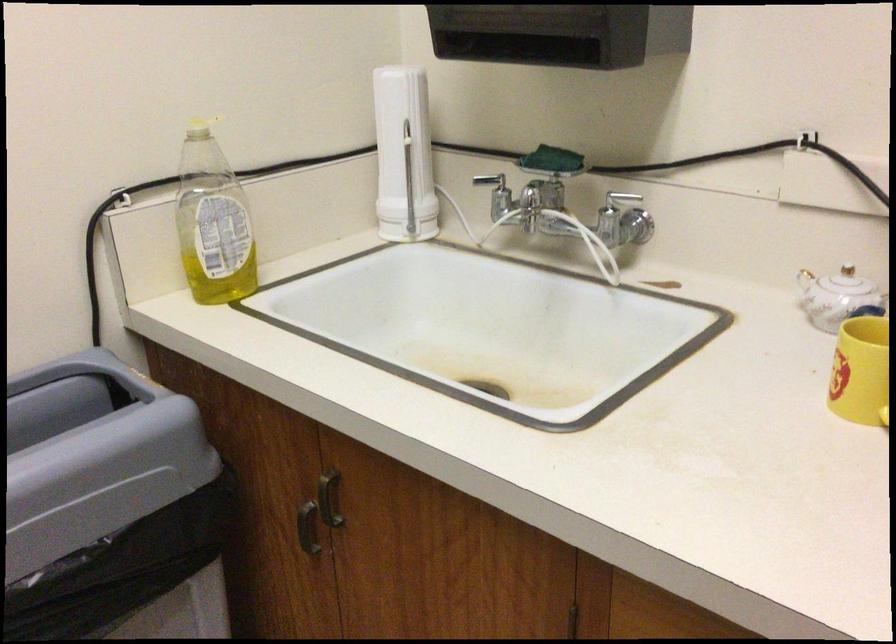
Where would you lift the yellow mug handle? Please return your answer as a coordinate pair (x, y).

(877, 417)